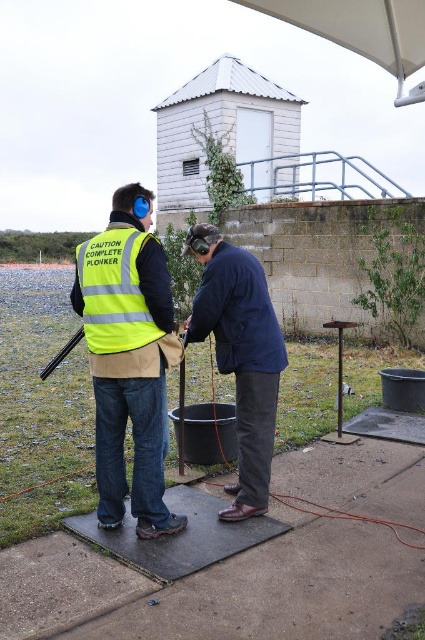
Who is higher up, concrete slab at center or dark blue fabric at center?

dark blue fabric at center is above.

Measure the distance between concrete slab at center and camera.

2.63 meters

The width and height of the screenshot is (425, 640). What do you see at coordinates (217, 588) in the screenshot? I see `concrete slab at center` at bounding box center [217, 588].

Identify the location of concrete slab at center. The image size is (425, 640). (217, 588).

Does dark blue fabric at center have a lesser width compared to yellow reflective safety vest at left?

No, dark blue fabric at center is not thinner than yellow reflective safety vest at left.

Is point (252, 291) farther from viewer compared to point (133, 228)?

Yes, it is.

Image resolution: width=425 pixels, height=640 pixels. What do you see at coordinates (240, 355) in the screenshot?
I see `dark blue fabric at center` at bounding box center [240, 355].

The width and height of the screenshot is (425, 640). Find the location of `dark blue fabric at center`. dark blue fabric at center is located at coordinates (240, 355).

Which of these two, concrete slab at center or yellow reflective safety vest at left, stands shorter?

concrete slab at center

Who is taller, concrete slab at center or yellow reflective safety vest at left?

yellow reflective safety vest at left is taller.

Who is more distant from viewer, (62, 632) or (91, 298)?

Point (91, 298)

The height and width of the screenshot is (640, 425). In order to click on concrete slab at center in this screenshot , I will do `click(217, 588)`.